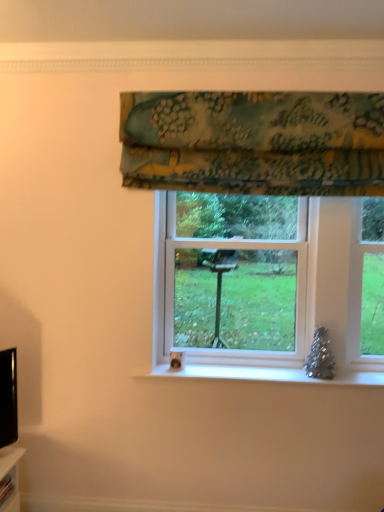
Find the location of a particular element. The width and height of the screenshot is (384, 512). free space above textured floral fabric at upper center (from a real-world perspective) is located at coordinates (254, 87).